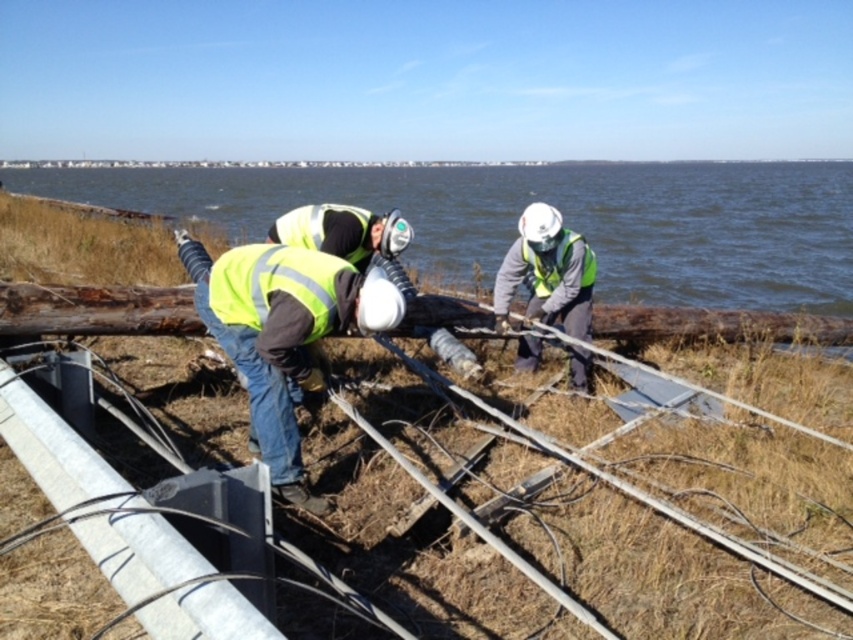
Can you confirm if blue water at center is shorter than reflective yellow safety vest at center?

No, blue water at center is not shorter than reflective yellow safety vest at center.

This screenshot has height=640, width=853. What do you see at coordinates (561, 212) in the screenshot?
I see `blue water at center` at bounding box center [561, 212].

Locate an element on the screen. The width and height of the screenshot is (853, 640). blue water at center is located at coordinates (561, 212).